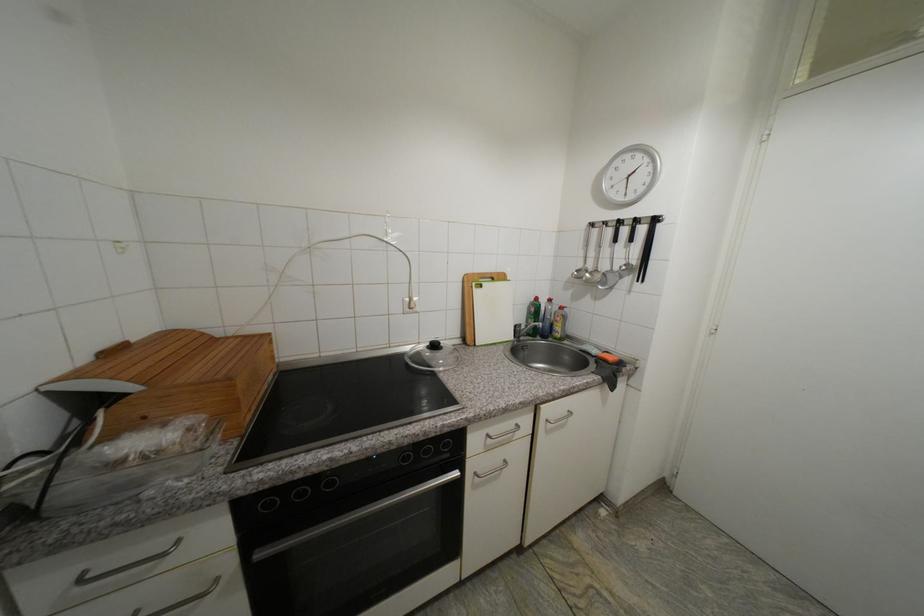
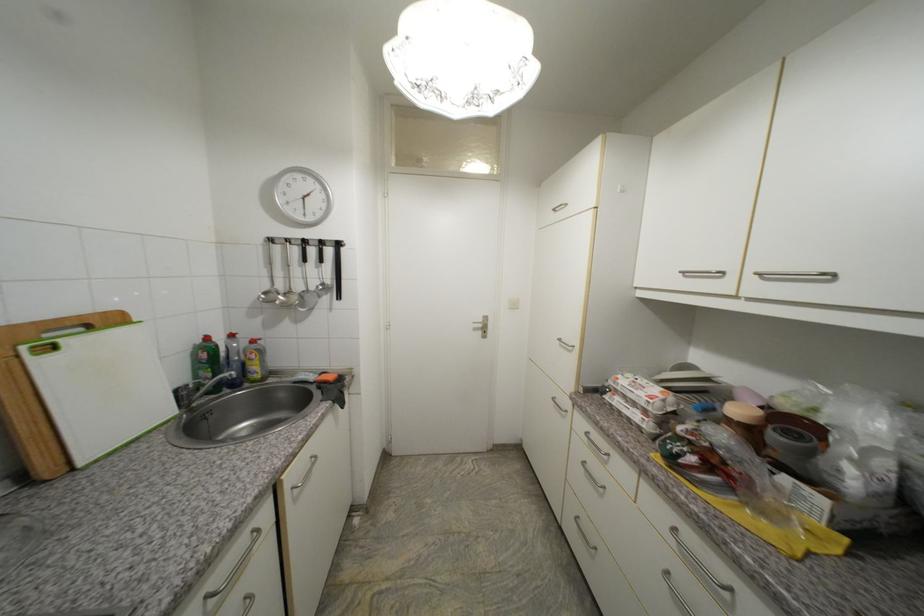
Locate, in the second image, the point that corresponds to point 610,268 in the first image.

(305, 289)